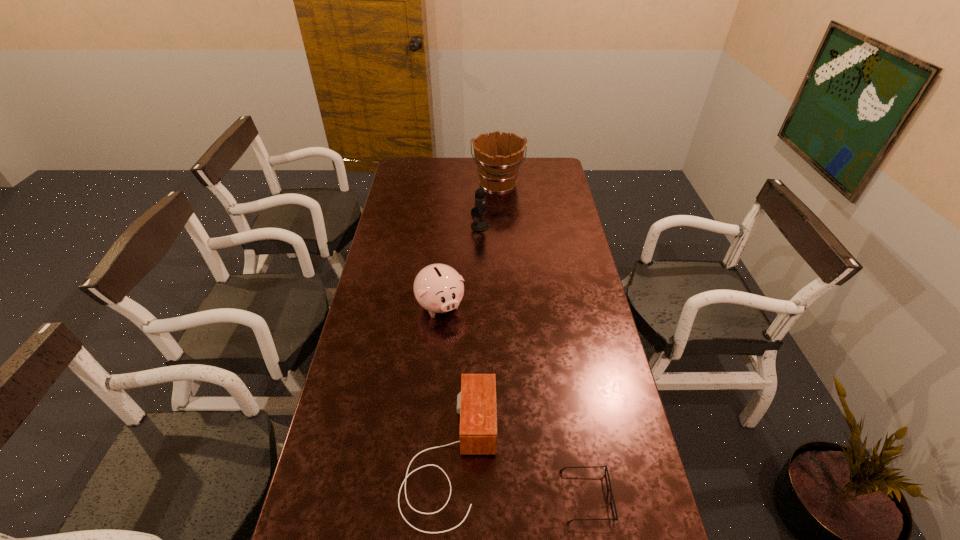
This screenshot has width=960, height=540. Identify the location of object present at the far edge. (498, 157).

Identify the location of object located at the right edge. (615, 518).

This screenshot has width=960, height=540. In the image, there is a desktop. Identify the location of vacant space at the far edge. (468, 165).

In the image, there is a desktop. At what (x,y) coordinates should I click in order to perform the action: click on vacant area at the left edge. Please return your answer as a coordinate pair (x, y). The height and width of the screenshot is (540, 960). Looking at the image, I should click on point(368,445).

You are a GUI agent. You are given a task and a screenshot of the screen. Output one action in this format:
    pyautogui.click(x=<x>, y=<y>)
    Task: Click on the blank space at the right edge of the desktop
    
    Given the screenshot: What is the action you would take?
    pyautogui.click(x=562, y=190)

Where is `vacant space at the far right corner`? This screenshot has width=960, height=540. vacant space at the far right corner is located at coordinates 540,161.

Identify the location of free point between the fourth tallest object and the microphone. The height and width of the screenshot is (540, 960). (465, 341).

At what (x,y) coordinates should I click in order to perform the action: click on free space between the spectacles and the microphone. Please return your answer as a coordinate pair (x, y). The image size is (960, 540). Looking at the image, I should click on (533, 361).

Image resolution: width=960 pixels, height=540 pixels. I want to click on free space that is in between the piggy bank and the farthest object, so click(469, 244).

Locate an element on the screen. The image size is (960, 540). free space that is in between the shortest object and the second farthest object is located at coordinates (533, 361).